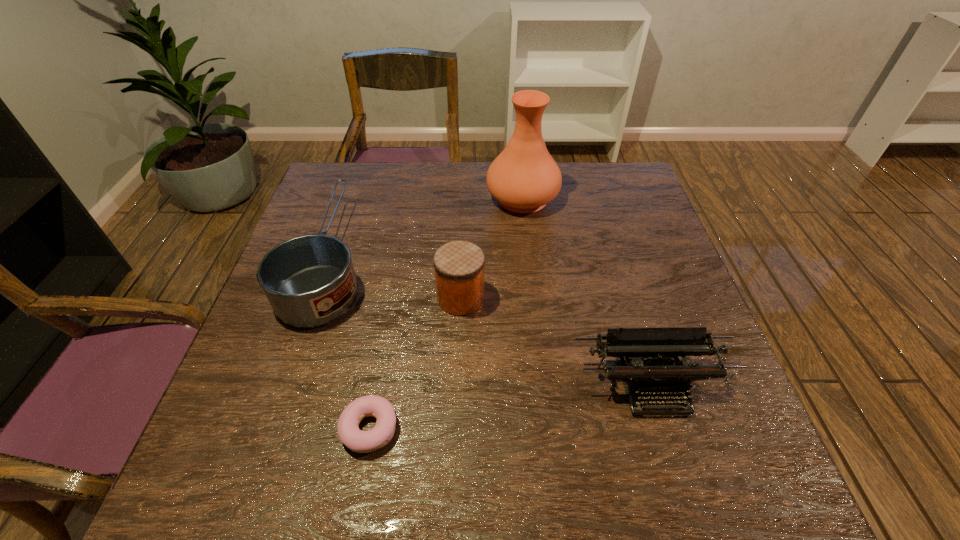
Where is `vacant space located 0.120m with the handle extending from one side of the saucepan`? vacant space located 0.120m with the handle extending from one side of the saucepan is located at coordinates (357, 181).

The image size is (960, 540). In order to click on free location located 0.050m on the typing side of the typewriter in this screenshot , I will do pos(669,443).

Locate an element on the screen. The image size is (960, 540). vacant space located 0.050m on the right of the second object from left to right is located at coordinates (425, 429).

The image size is (960, 540). Find the location of `vase that is at the far edge`. vase that is at the far edge is located at coordinates 524,177.

Where is `saucepan located in the far edge section of the desktop`? saucepan located in the far edge section of the desktop is located at coordinates (309, 280).

The height and width of the screenshot is (540, 960). Find the location of `object at the near edge`. object at the near edge is located at coordinates (350, 435).

This screenshot has height=540, width=960. I want to click on object that is at the left edge, so pyautogui.click(x=309, y=280).

This screenshot has height=540, width=960. I want to click on object present at the right edge, so click(x=656, y=376).

I want to click on object that is at the far left corner, so click(x=309, y=280).

In the image, there is a desktop. Where is `vacant space at the far edge`? vacant space at the far edge is located at coordinates (x=380, y=163).